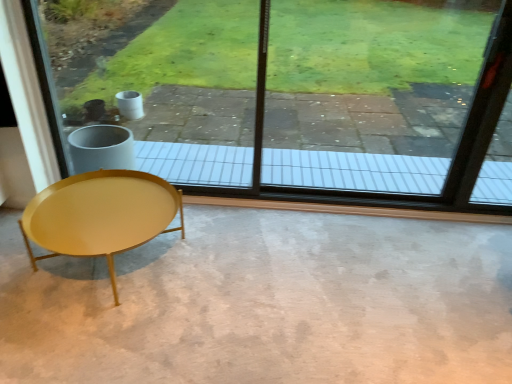
This screenshot has width=512, height=384. In order to click on free point above smooth concrete floor at center (from a real-world perspective) in this screenshot , I will do `click(197, 288)`.